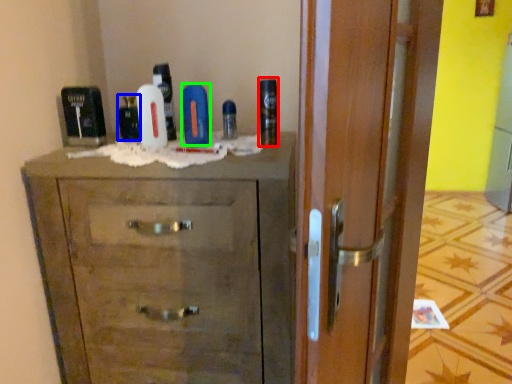
Question: Which object is positioned closest to shaving cream (highlighted by a red box)? Select from mouthwash (highlighted by a blue box) and toiletry (highlighted by a green box).

Choices:
 (A) mouthwash
 (B) toiletry

Answer: (B)